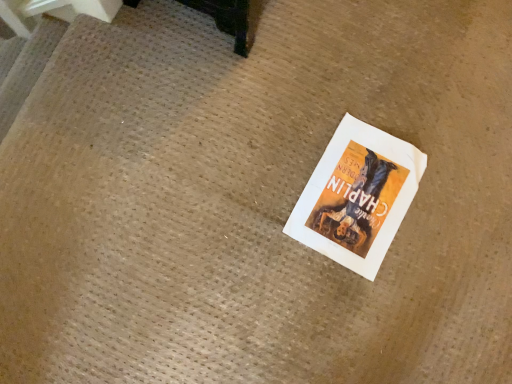
The height and width of the screenshot is (384, 512). In order to click on vacant area on top of white paper poster at center (from a real-world perspective) in this screenshot , I will do `click(360, 193)`.